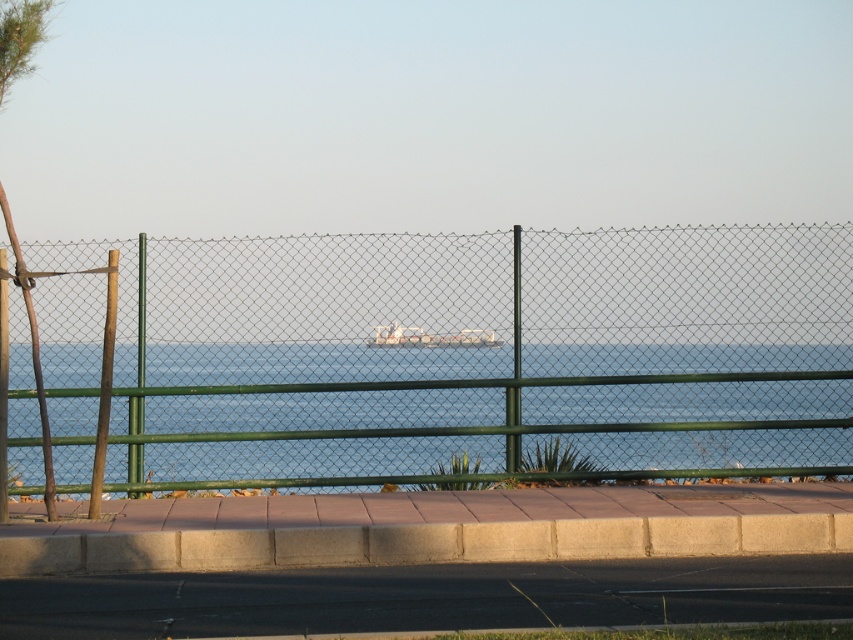
You are standing behind the green chain link fence and want to place a small potted plant on the gray concrete pavement at lower center. Can you determine if the brown wooden pole at left will block the view of the plant from your current position?

The gray concrete pavement at lower center is shorter than the brown wooden pole at left. Since the pavement is shorter, the pole may block the view of the plant depending on their positions. However, without knowing the exact distance between them, it is uncertain if the pole will obstruct the view.

You are standing behind the green metallic pole at center and want to see the metallic silver boat at center. Can you see the boat without moving your head?

The green metallic pole at center is located below the metallic silver boat at center, so yes, you can see the boat without moving your head as the pole is positioned lower than the boat.